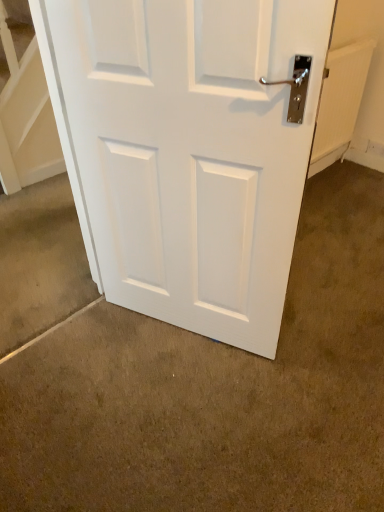
Measure the distance between white matte door at center and camera.

The depth of white matte door at center is 1.20 meters.

At what (x,y) coordinates should I click in order to perform the action: click on white matte door at center. Please return your answer as a coordinate pair (x, y). The image size is (384, 512). Looking at the image, I should click on (217, 392).

The width and height of the screenshot is (384, 512). Describe the element at coordinates (217, 392) in the screenshot. I see `white matte door at center` at that location.

Locate an element on the screen. Image resolution: width=384 pixels, height=512 pixels. white matte door at center is located at coordinates (192, 152).

What do you see at coordinates (192, 152) in the screenshot? I see `white matte door at center` at bounding box center [192, 152].

Where is `white matte door at center`? white matte door at center is located at coordinates [217, 392].

Considering the relative positions of white matte door at center and white matte door at center in the image provided, is white matte door at center to the right of white matte door at center from the viewer's perspective?

No.

Is white matte door at center behind white matte door at center?

Yes.

Does point (234, 158) appear closer or farther from the camera than point (352, 354)?

Point (234, 158) is closer to the camera than point (352, 354).

From the image's perspective, is white matte door at center above or below white matte door at center?

white matte door at center is situated higher than white matte door at center in the image.

From a real-world perspective, is white matte door at center positioned under white matte door at center based on gravity?

Incorrect, from a real-world perspective, white matte door at center is higher than white matte door at center.

Considering the relative sizes of white matte door at center and white matte door at center in the image provided, is white matte door at center wider than white matte door at center?

No.

Between white matte door at center and white matte door at center, which one has more height?

Standing taller between the two is white matte door at center.

Does white matte door at center have a smaller size compared to white matte door at center?

Yes, white matte door at center is smaller than white matte door at center.

In the scene shown: Would you say white matte door at center contains white matte door at center?

No.

Is white matte door at center far away from white matte door at center?

No, white matte door at center is not far away from white matte door at center.

Is white matte door at center facing away from white matte door at center?

Yes, white matte door at center's orientation is away from white matte door at center.

How far apart are white matte door at center and white matte door at center?

white matte door at center is 20.87 inches away from white matte door at center.

This screenshot has width=384, height=512. What are the coordinates of `concrete on the right of white matte door at center` in the screenshot? It's located at (217, 392).

Based on their positions, is white matte door at center located to the left or right of white matte door at center?

white matte door at center is to the right of white matte door at center.

Relative to white matte door at center, is white matte door at center in front or behind?

white matte door at center is positioned closer to the viewer than white matte door at center.

Which is behind, point (115, 425) or point (107, 42)?

Positioned behind is point (115, 425).

From the image's perspective, is white matte door at center on top of white matte door at center?

No.

From a real-world perspective, between white matte door at center and white matte door at center, who is vertically lower?

In real-world perspective, white matte door at center is lower.

Which of these two, white matte door at center or white matte door at center, is wider?

white matte door at center is wider.

Does white matte door at center have a greater height compared to white matte door at center?

No.

Looking at the image, does white matte door at center seem bigger or smaller compared to white matte door at center?

Considering their sizes, white matte door at center takes up more space than white matte door at center.

Is white matte door at center not inside white matte door at center?

That's correct, white matte door at center is outside of white matte door at center.

Is white matte door at center beside white matte door at center?

There is a gap between white matte door at center and white matte door at center.

Is white matte door at center aimed at white matte door at center?

No, white matte door at center is not oriented towards white matte door at center.

Measure the distance between white matte door at center and white matte door at center.

white matte door at center and white matte door at center are 20.87 inches apart.

Locate an element on the screen. This screenshot has height=512, width=384. door that appears on the left of white matte door at center is located at coordinates (192, 152).

Where is `concrete beneath the white matte door at center (from a real-world perspective)`? This screenshot has width=384, height=512. concrete beneath the white matte door at center (from a real-world perspective) is located at coordinates (217, 392).

This screenshot has width=384, height=512. In the image, there is a white matte door at center. Find the location of `concrete below it (from the image's perspective)`. concrete below it (from the image's perspective) is located at coordinates (217, 392).